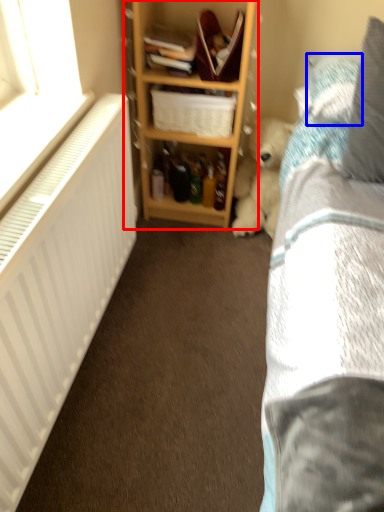
Question: Which object appears closest to the camera in this image, shelf (highlighted by a red box) or pillow (highlighted by a blue box)?

Choices:
 (A) shelf
 (B) pillow

Answer: (B)